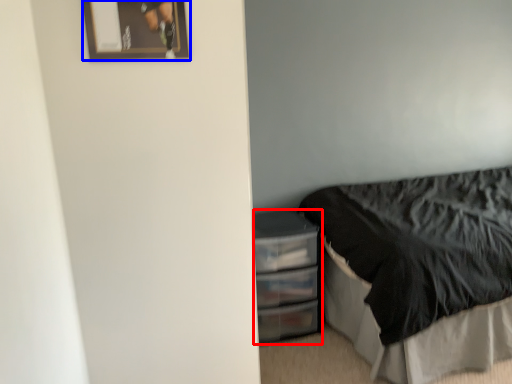
Question: Among these objects, which one is farthest to the camera, file cabinet (highlighted by a red box) or picture frame (highlighted by a blue box)?

Choices:
 (A) file cabinet
 (B) picture frame

Answer: (A)